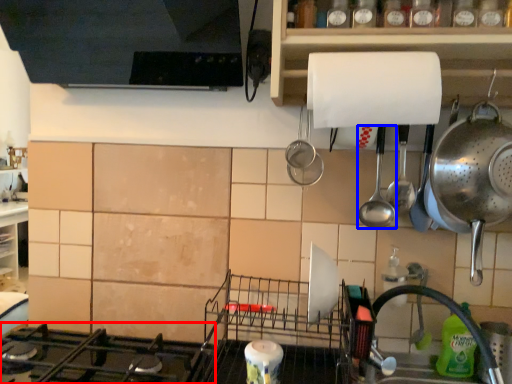
Question: Which point is further to the camera, gas stove (highlighted by a red box) or spoon (highlighted by a blue box)?

Choices:
 (A) gas stove
 (B) spoon

Answer: (B)